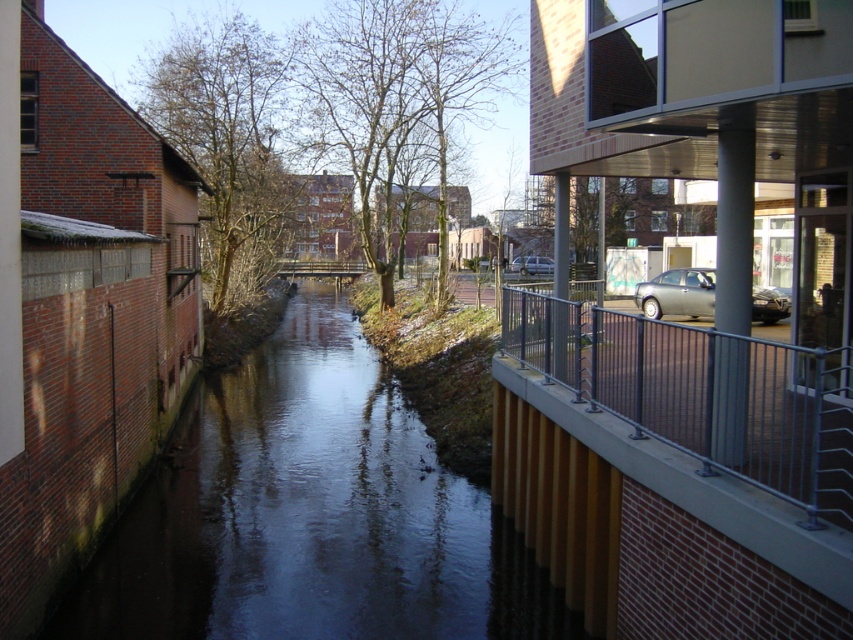
Question: Which object is positioned closest to the metallic gray sedan at center right?

Choices:
 (A) bare branches at center
 (B) dark water at center

Answer: (B)

Question: Is metal/rail at right above bare branches at center?

Choices:
 (A) yes
 (B) no

Answer: (B)

Question: Does metal/rail at right appear on the right side of metallic gray sedan at center right?

Choices:
 (A) yes
 (B) no

Answer: (B)

Question: Does brown leafy tree at upper left come behind silver metallic car at center?

Choices:
 (A) no
 (B) yes

Answer: (A)

Question: Which object is positioned closest to the metallic gray sedan at center right?

Choices:
 (A) silver metallic car at center
 (B) bare branches at center
 (C) brown leafy tree at upper left
 (D) dark water at center

Answer: (D)

Question: Among these points, which one is farthest from the camera?

Choices:
 (A) (730, 372)
 (B) (323, 522)

Answer: (B)